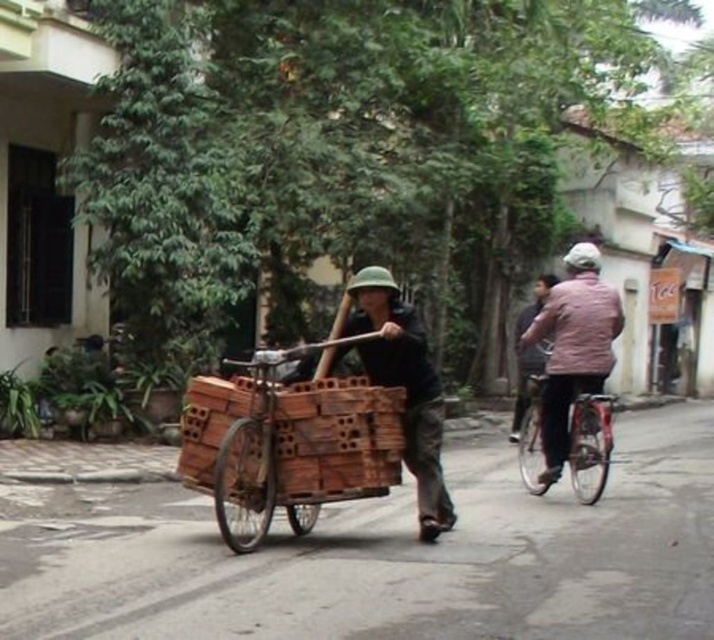
Question: Can you confirm if wooden cart at center is positioned below wooden helmet at center?

Choices:
 (A) no
 (B) yes

Answer: (B)

Question: Which object is closer to the camera taking this photo?

Choices:
 (A) wooden helmet at center
 (B) pink fabric shirt at right
 (C) metallic silver bicycle at right
 (D) wooden cart at center

Answer: (D)

Question: Is wooden cart at center further to camera compared to metallic silver bicycle at right?

Choices:
 (A) yes
 (B) no

Answer: (B)

Question: Which point is closer to the camera taking this photo?

Choices:
 (A) (516, 424)
 (B) (357, 282)

Answer: (B)

Question: Which of these objects is positioned farthest from the wooden helmet at center?

Choices:
 (A) metallic silver bicycle at right
 (B) wooden cart at center
 (C) pink fabric shirt at right

Answer: (C)

Question: Is wooden cart at center wider than wooden helmet at center?

Choices:
 (A) yes
 (B) no

Answer: (A)